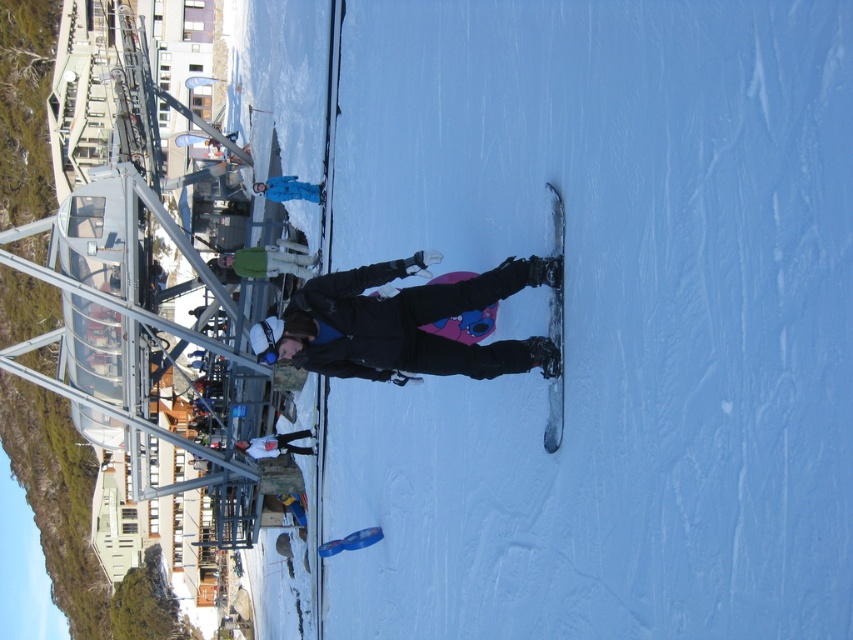
You are a photographer trying to capture the metallic gray snowboard at center and the green fabric jacket at center in a single shot. Which object will appear larger in your photo?

The metallic gray snowboard at center will appear larger in the photo because it is closer to the viewer than the green fabric jacket at center.

You are a drone operator trying to capture aerial footage of the ski resort. You have two points marked in the image for reference. The first point is at coordinate point (x=550, y=305), and the second point is at coordinate point (x=251, y=250). Which point should you prioritize if you want to focus on the foreground elements of the scene?

Point (x=550, y=305) is closer to the viewer than point (x=251, y=250), so you should prioritize point (x=550, y=305) to focus on the foreground elements.